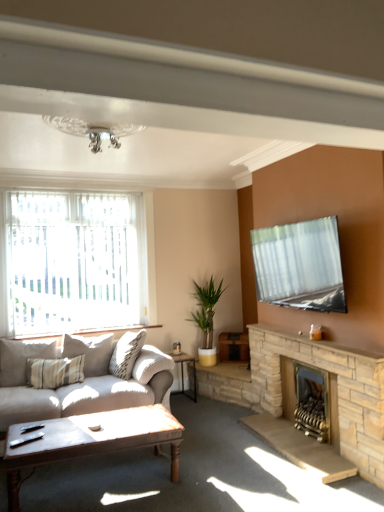
Question: Does stone fireplace at right, which is the 1th fireplace in front-to-back order, have a smaller size compared to translucent fabric window at left?

Choices:
 (A) no
 (B) yes

Answer: (A)

Question: Does stone fireplace at right, the 2th fireplace in the back-to-front sequence, contain translucent fabric window at left?

Choices:
 (A) no
 (B) yes

Answer: (A)

Question: Is stone fireplace at right, which is the 1th fireplace in front-to-back order, bigger than translucent fabric window at left?

Choices:
 (A) no
 (B) yes

Answer: (B)

Question: Can you confirm if stone fireplace at right, which is the 1th fireplace in front-to-back order, is wider than translucent fabric window at left?

Choices:
 (A) no
 (B) yes

Answer: (B)

Question: Considering the relative positions of stone fireplace at right, the 2th fireplace in the back-to-front sequence, and translucent fabric window at left in the image provided, is stone fireplace at right, the 2th fireplace in the back-to-front sequence, to the left of translucent fabric window at left from the viewer's perspective?

Choices:
 (A) no
 (B) yes

Answer: (A)

Question: Is wooden polished coffee table at lower center taller or shorter than translucent fabric window at left?

Choices:
 (A) tall
 (B) short

Answer: (B)

Question: Considering the positions of wooden polished coffee table at lower center and translucent fabric window at left in the image, is wooden polished coffee table at lower center wider or thinner than translucent fabric window at left?

Choices:
 (A) thin
 (B) wide

Answer: (B)

Question: Is wooden polished coffee table at lower center inside the boundaries of translucent fabric window at left, or outside?

Choices:
 (A) inside
 (B) outside

Answer: (B)

Question: From a real-world perspective, is wooden polished coffee table at lower center physically located above or below translucent fabric window at left?

Choices:
 (A) below
 (B) above

Answer: (A)

Question: Does point (253, 343) appear closer or farther from the camera than point (26, 345)?

Choices:
 (A) closer
 (B) farther

Answer: (B)

Question: Is stone fireplace at right, the 2th fireplace in the back-to-front sequence, in front of or behind light beige fabric pillow at left in the image?

Choices:
 (A) behind
 (B) front

Answer: (B)

Question: Based on their sizes in the image, would you say stone fireplace at right, the 2th fireplace in the back-to-front sequence, is bigger or smaller than light beige fabric pillow at left?

Choices:
 (A) small
 (B) big

Answer: (B)

Question: Considering the positions of stone fireplace at right, the 2th fireplace in the back-to-front sequence, and light beige fabric pillow at left in the image, is stone fireplace at right, the 2th fireplace in the back-to-front sequence, taller or shorter than light beige fabric pillow at left?

Choices:
 (A) tall
 (B) short

Answer: (A)

Question: From the image's perspective, is light beige fabric pillow at left above or below brick fireplace at lower right, which is counted as the 2th fireplace, starting from the front?

Choices:
 (A) above
 (B) below

Answer: (A)

Question: Based on their positions, is light beige fabric pillow at left located to the left or right of brick fireplace at lower right, the 1th fireplace in the back-to-front sequence?

Choices:
 (A) right
 (B) left

Answer: (B)